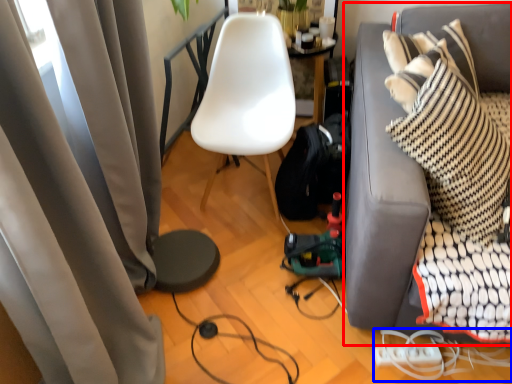
Question: Which point is further to the camera, studio couch (highlighted by a red box) or cable (highlighted by a blue box)?

Choices:
 (A) studio couch
 (B) cable

Answer: (B)